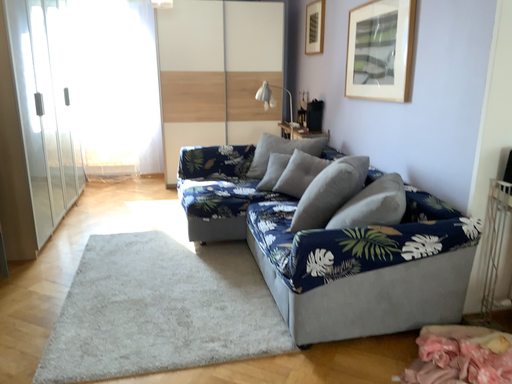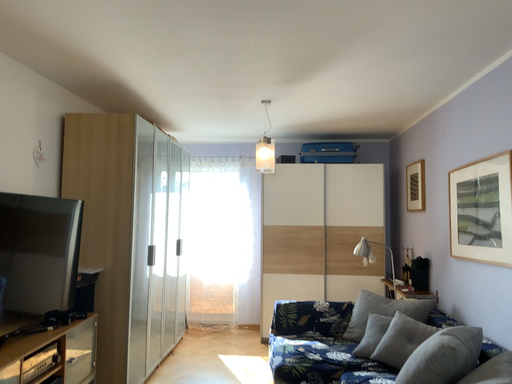
Question: How did the camera likely rotate when shooting the video?

Choices:
 (A) rotated right
 (B) rotated left

Answer: (B)